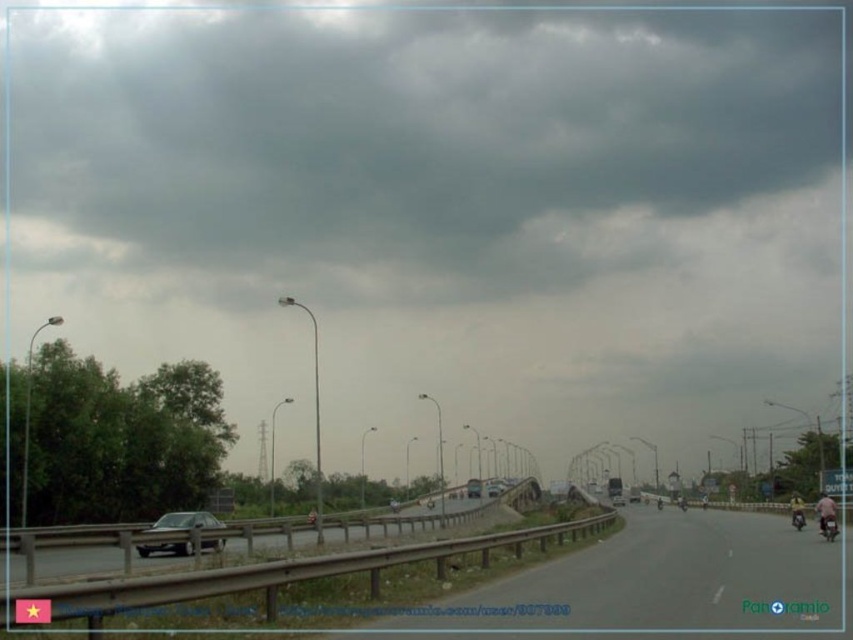
From the picture: Who is higher up, asphalt road at center or metallic silver sedan at center?

asphalt road at center is higher up.

Is point (727, 627) farther from viewer compared to point (498, 493)?

No, (727, 627) is in front of (498, 493).

This screenshot has width=853, height=640. Find the location of `asphalt road at center`. asphalt road at center is located at coordinates (659, 582).

Is smooth asphalt highway at center to the right of metallic silver car at center from the viewer's perspective?

Incorrect, smooth asphalt highway at center is not on the right side of metallic silver car at center.

Does smooth asphalt highway at center have a larger size compared to metallic silver car at center?

Correct, smooth asphalt highway at center is larger in size than metallic silver car at center.

This screenshot has height=640, width=853. In order to click on smooth asphalt highway at center in this screenshot , I will do `click(380, 531)`.

Identify the location of smooth asphalt highway at center. This screenshot has height=640, width=853. (380, 531).

Between asphalt road at center and metallic silver car at center, which one has less height?

metallic silver car at center

Between asphalt road at center and metallic silver car at center, which one appears on the right side from the viewer's perspective?

metallic silver car at center

Is point (621, 557) positioned before point (624, 500)?

Yes, point (621, 557) is in front of point (624, 500).

Find the location of a particular element. The width and height of the screenshot is (853, 640). asphalt road at center is located at coordinates (659, 582).